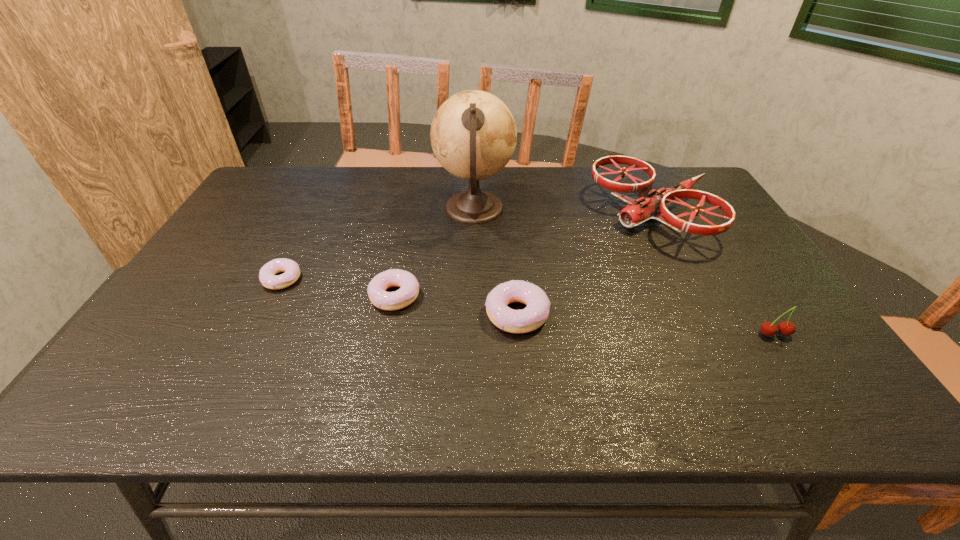
Image resolution: width=960 pixels, height=540 pixels. Identify the location of cherry that is at the right edge. (786, 328).

Where is `object that is at the far right corner`? Image resolution: width=960 pixels, height=540 pixels. object that is at the far right corner is located at coordinates (649, 206).

Locate an element on the screen. object located in the near right corner section of the desktop is located at coordinates (786, 328).

What are the coordinates of `vacant space at the far edge of the desktop` in the screenshot? It's located at (322, 170).

The width and height of the screenshot is (960, 540). In the image, there is a desktop. In order to click on vacant space at the near edge in this screenshot , I will do `click(309, 354)`.

Image resolution: width=960 pixels, height=540 pixels. In the image, there is a desktop. What are the coordinates of `free space at the left edge` in the screenshot? It's located at (261, 205).

Identify the location of vacant space at the right edge. The width and height of the screenshot is (960, 540). point(679,210).

Image resolution: width=960 pixels, height=540 pixels. What are the coordinates of `blank space at the near right corner` in the screenshot? It's located at (763, 359).

The width and height of the screenshot is (960, 540). What are the coordinates of `unoccupied area between the drone and the globe` in the screenshot? It's located at (564, 213).

You are a GUI agent. You are given a task and a screenshot of the screen. Output one action in this format:
    pyautogui.click(x=<x>, y=<y>)
    Task: Click on the free space between the globe and the fourth shortest object
    
    Given the screenshot: What is the action you would take?
    click(624, 272)